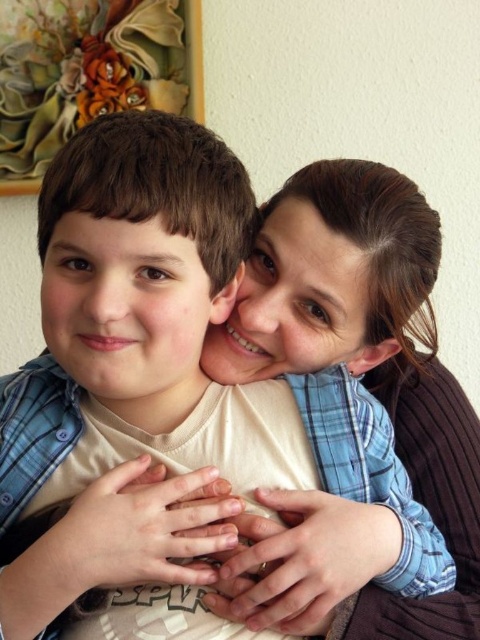
Question: Among these objects, which one is farthest from the camera?

Choices:
 (A) painted floral artwork at upper left
 (B) matte brown hair at upper center

Answer: (A)

Question: Which object appears closest to the camera in this image?

Choices:
 (A) painted floral artwork at upper left
 (B) matte brown hair at upper center

Answer: (B)

Question: Does matte brown hair at upper center lie behind painted floral artwork at upper left?

Choices:
 (A) yes
 (B) no

Answer: (B)

Question: Among these points, which one is nearest to the camera?

Choices:
 (A) (460, 605)
 (B) (199, 1)

Answer: (A)

Question: Is matte brown hair at upper center further to camera compared to painted floral artwork at upper left?

Choices:
 (A) yes
 (B) no

Answer: (B)

Question: Can you confirm if matte brown hair at upper center is positioned below painted floral artwork at upper left?

Choices:
 (A) yes
 (B) no

Answer: (A)